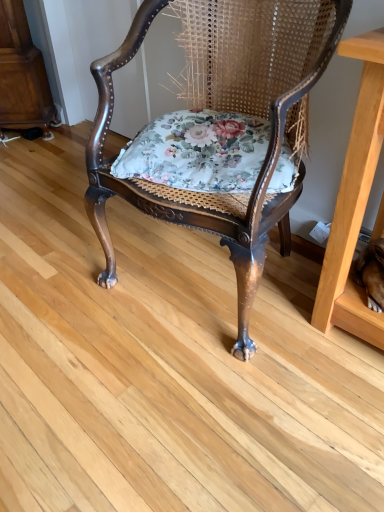
Locate an element on the screen. Image resolution: width=384 pixels, height=512 pixels. floral fabric cushion at center is located at coordinates (197, 151).

The height and width of the screenshot is (512, 384). What do you see at coordinates (197, 151) in the screenshot? I see `floral fabric cushion at center` at bounding box center [197, 151].

At what (x,y) coordinates should I click in order to perform the action: click on polished wood chair at center. Please return your answer as a coordinate pair (x, y). Looking at the image, I should click on (224, 110).

This screenshot has width=384, height=512. What do you see at coordinates (224, 110) in the screenshot?
I see `polished wood chair at center` at bounding box center [224, 110].

The image size is (384, 512). Identify the location of floral fabric cushion at center. (197, 151).

Considering the relative positions of polished wood chair at center and floral fabric cushion at center in the image provided, is polished wood chair at center to the left of floral fabric cushion at center from the viewer's perspective?

No.

Is polished wood chair at center in front of floral fabric cushion at center?

Yes, it is in front of floral fabric cushion at center.

Is point (276, 105) closer or farther from the camera than point (129, 155)?

Point (276, 105) appears to be closer to the viewer than point (129, 155).

From the picture: From the image's perspective, which one is positioned higher, polished wood chair at center or floral fabric cushion at center?

polished wood chair at center.

From a real-world perspective, is polished wood chair at center positioned under floral fabric cushion at center based on gravity?

Indeed, from a real-world perspective, polished wood chair at center is positioned beneath floral fabric cushion at center.

Which of these two, polished wood chair at center or floral fabric cushion at center, is thinner?

With smaller width is floral fabric cushion at center.

Considering the relative sizes of polished wood chair at center and floral fabric cushion at center in the image provided, is polished wood chair at center taller than floral fabric cushion at center?

Indeed, polished wood chair at center has a greater height compared to floral fabric cushion at center.

Between polished wood chair at center and floral fabric cushion at center, which one has larger size?

→ polished wood chair at center is bigger.

Is polished wood chair at center not inside floral fabric cushion at center?

That's correct, polished wood chair at center is outside of floral fabric cushion at center.

Is polished wood chair at center touching floral fabric cushion at center?

No, polished wood chair at center is not in contact with floral fabric cushion at center.

Is polished wood chair at center facing towards floral fabric cushion at center?

Yes, polished wood chair at center is turned towards floral fabric cushion at center.

How different are the orientations of polished wood chair at center and floral fabric cushion at center in degrees?

The facing directions of polished wood chair at center and floral fabric cushion at center are 12.7 degrees apart.

I want to click on blanket behind the polished wood chair at center, so click(197, 151).

Which object is positioned more to the left, floral fabric cushion at center or polished wood chair at center?

From the viewer's perspective, floral fabric cushion at center appears more on the left side.

Which object is closer to the camera, floral fabric cushion at center or polished wood chair at center?

polished wood chair at center is more forward.

Is point (168, 137) closer or farther from the camera than point (145, 21)?

Point (168, 137).

From the image's perspective, would you say floral fabric cushion at center is positioned over polished wood chair at center?

No.

From a real-world perspective, is floral fabric cushion at center located beneath polished wood chair at center?

No, from a real-world perspective, floral fabric cushion at center is not below polished wood chair at center.

Consider the image. In terms of width, does floral fabric cushion at center look wider or thinner when compared to polished wood chair at center?

In the image, floral fabric cushion at center appears to be more narrow than polished wood chair at center.

Can you confirm if floral fabric cushion at center is shorter than polished wood chair at center?

Indeed, floral fabric cushion at center has a lesser height compared to polished wood chair at center.

Does floral fabric cushion at center have a larger size compared to polished wood chair at center?

No.

Does floral fabric cushion at center contain polished wood chair at center?

No.

Is floral fabric cushion at center next to polished wood chair at center and touching it?

No, floral fabric cushion at center is not next to polished wood chair at center.

Is floral fabric cushion at center oriented towards polished wood chair at center?

Yes, floral fabric cushion at center is turned towards polished wood chair at center.

Can you tell me how much floral fabric cushion at center and polished wood chair at center differ in facing direction?

12.7 degrees separate the facing orientations of floral fabric cushion at center and polished wood chair at center.

Measure the distance between floral fabric cushion at center and polished wood chair at center.

They are 12.91 centimeters apart.

Find the location of a particular element. This screenshot has width=384, height=512. blanket below the polished wood chair at center (from the image's perspective) is located at coordinates (197, 151).

What are the coordinates of `chair in front of the floral fabric cushion at center` in the screenshot? It's located at (224, 110).

You are a GUI agent. You are given a task and a screenshot of the screen. Output one action in this format:
    pyautogui.click(x=<x>, y=<y>)
    Task: Click on the blanket above the polished wood chair at center (from a real-world perspective)
    
    Given the screenshot: What is the action you would take?
    pyautogui.click(x=197, y=151)